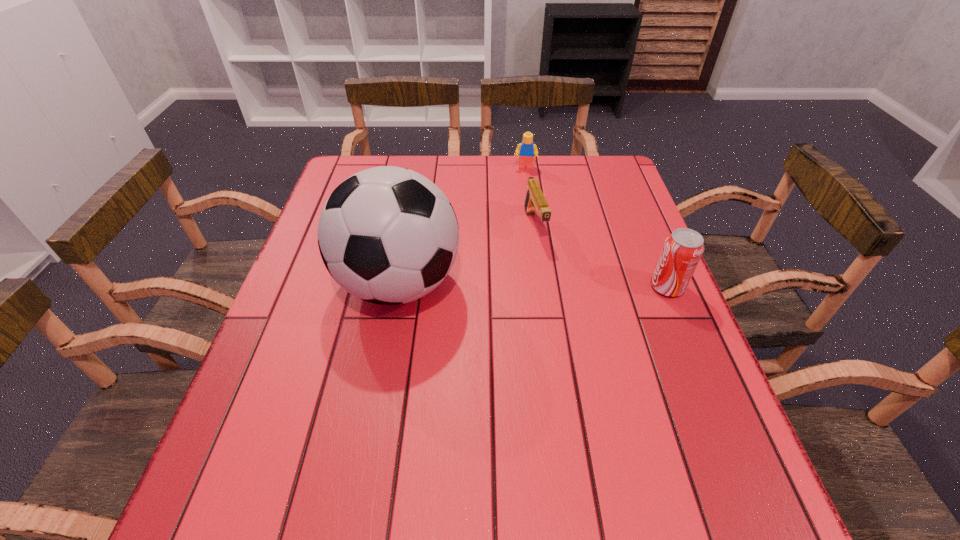
Locate an element on the screen. the tallest object is located at coordinates (388, 235).

Identify the location of the leftmost object. (388, 235).

Find the location of `soda can`. soda can is located at coordinates (681, 253).

In order to click on the second tallest object in this screenshot , I will do `click(681, 253)`.

In order to click on Lego in this screenshot , I will do `click(526, 150)`.

I want to click on pistol, so coord(535,200).

Where is `free location located on the back of the soccer ball`? Image resolution: width=960 pixels, height=540 pixels. free location located on the back of the soccer ball is located at coordinates (411, 220).

You are a GUI agent. You are given a task and a screenshot of the screen. Output one action in this format:
    pyautogui.click(x=<x>, y=<y>)
    Task: Click on the vacant space located on the logo side of the soda can
    The width and height of the screenshot is (960, 540).
    Given the screenshot: What is the action you would take?
    pyautogui.click(x=590, y=287)

Image resolution: width=960 pixels, height=540 pixels. Find the location of `vacant space located 0.340m on the logo side of the soda can`. vacant space located 0.340m on the logo side of the soda can is located at coordinates (506, 287).

Identify the location of vacant region located 0.350m on the logo side of the soda can. This screenshot has height=540, width=960. (502, 287).